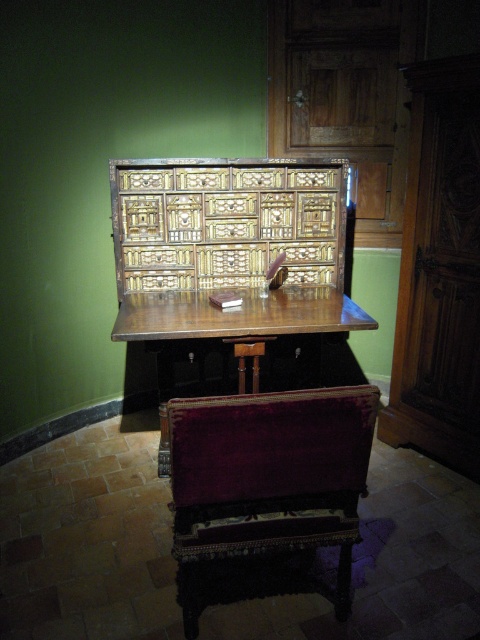
From the picture: You are standing in front of the antique desk in the historical setting. Where exactly is the polished wood table at center located in terms of its 2D coordinates?

The polished wood table at center is located at the 2D coordinates of point (x=231, y=326).

You are an interior designer planning to place a new lamp on the polished wood table at center. However, there is a wooden stool at center in the way. Can you place the lamp there without moving the stool?

The polished wood table at center is located above the wooden stool at center, meaning the stool is underneath the table. Therefore, you can place the lamp on the polished wood table at center without needing to move the stool since the stool is already positioned underneath it.

You are a visitor in the museum and want to sit down to admire the antique desk. There is a velvet burgundy chair at lower center and a wooden stool at center. Which one has a wider seating area?

The velvet burgundy chair at lower center has a wider seating area since its width is larger than that of the wooden stool at center.